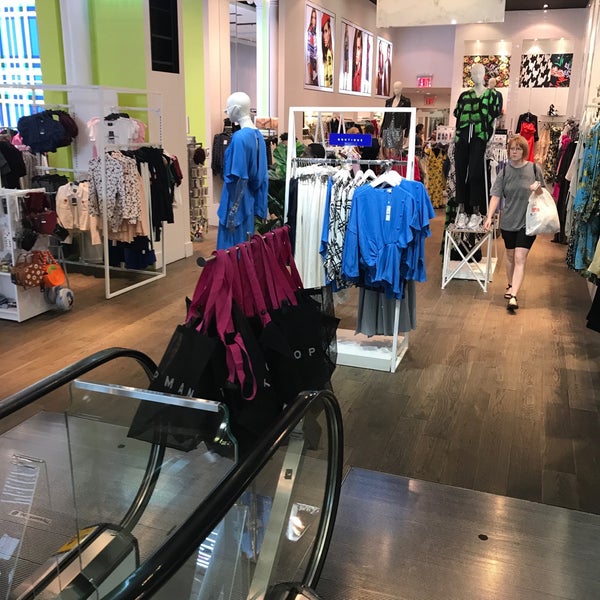
Where is `lights`? The height and width of the screenshot is (600, 600). lights is located at coordinates (449, 14), (462, 57), (497, 57), (529, 60), (565, 60), (544, 12).